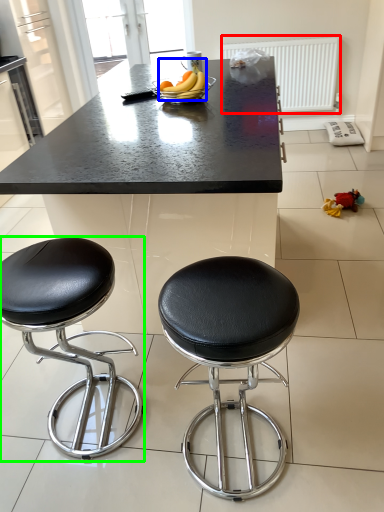
Question: Considering the real-world distances, which object is closest to radiator (highlighted by a red box)? banana (highlighted by a blue box) or stool (highlighted by a green box).

Choices:
 (A) banana
 (B) stool

Answer: (A)